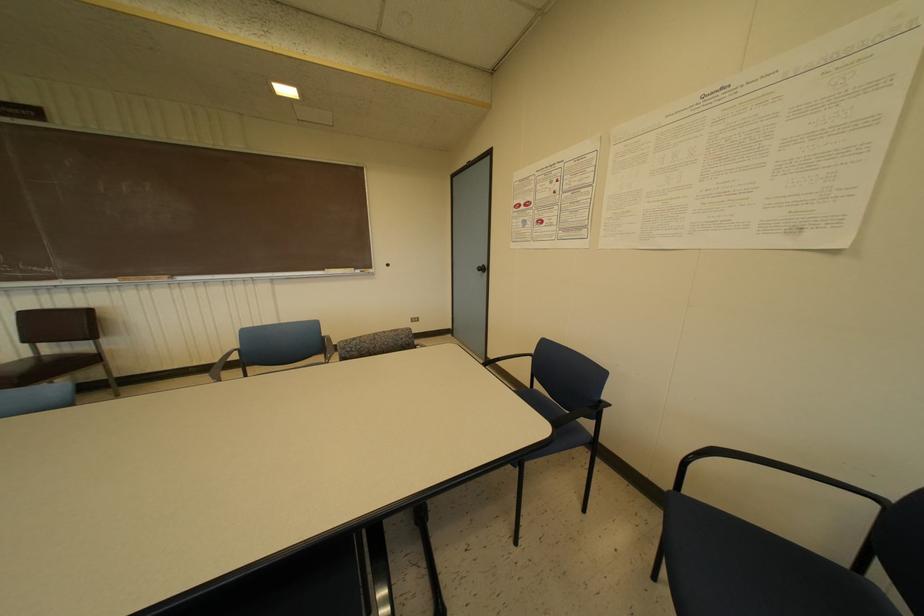
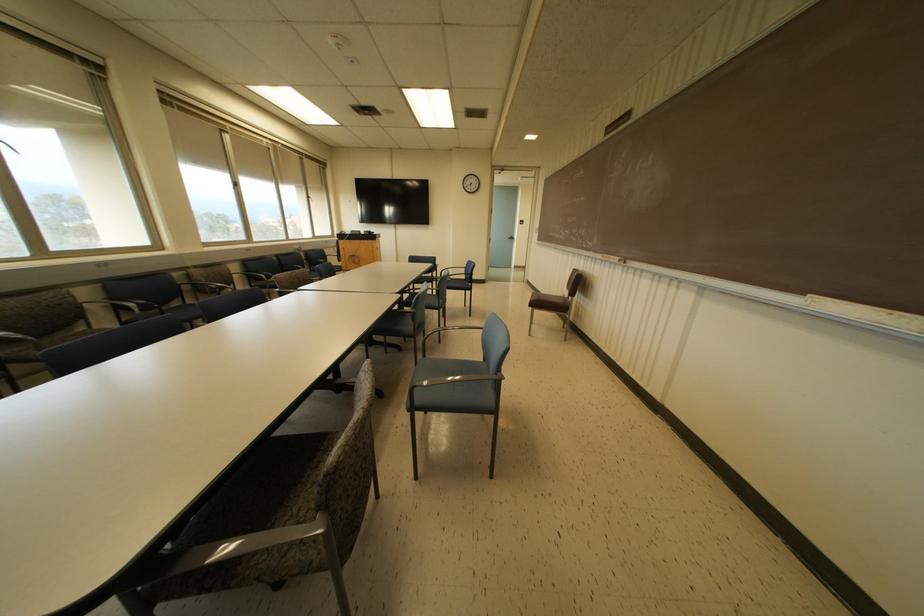
In the second image, find the point that corresponds to the point at 172,276 in the first image.

(623, 259)